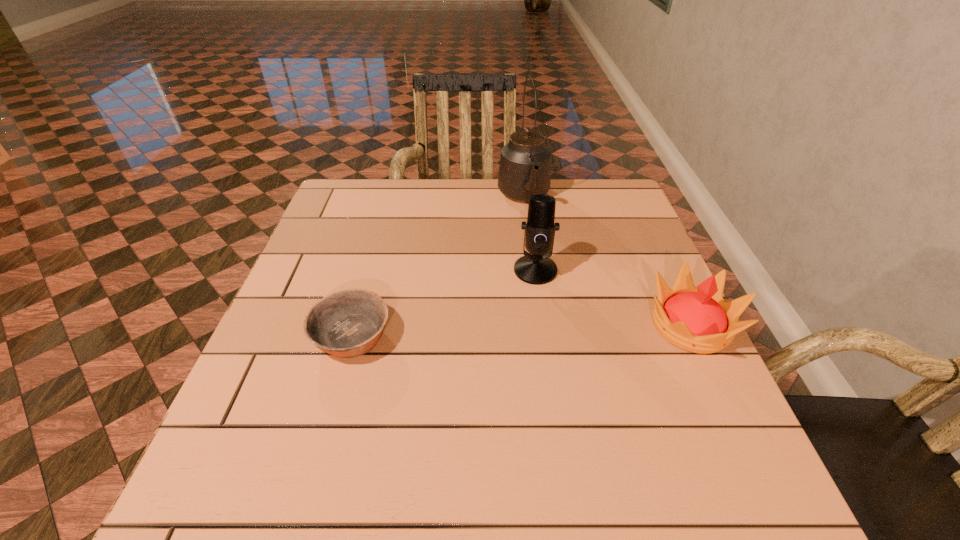
This screenshot has height=540, width=960. In order to click on the leftmost object in this screenshot , I will do `click(348, 323)`.

This screenshot has height=540, width=960. What are the coordinates of `the shortest object` in the screenshot? It's located at (348, 323).

Find the location of `the rightmost object`. the rightmost object is located at coordinates (697, 319).

Image resolution: width=960 pixels, height=540 pixels. I want to click on the second shortest object, so click(697, 319).

This screenshot has width=960, height=540. I want to click on microphone, so click(x=537, y=268).

Image resolution: width=960 pixels, height=540 pixels. In order to click on the second farthest object in this screenshot , I will do `click(537, 268)`.

Where is `the tallest object`? The width and height of the screenshot is (960, 540). the tallest object is located at coordinates (525, 162).

Locate an element on the screen. kettle is located at coordinates (525, 162).

This screenshot has width=960, height=540. Identify the location of vacant space located 0.060m on the back of the leftmost object. (365, 288).

Identify the location of free region located 0.060m on the back of the rightmost object. (667, 275).